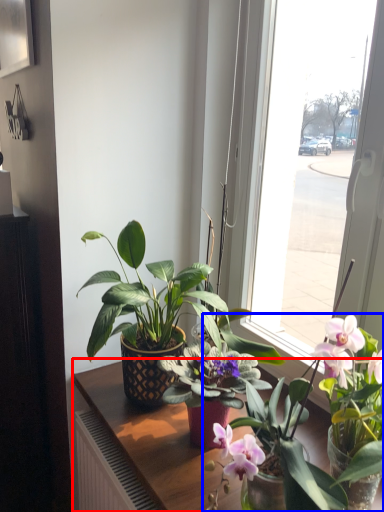
Question: Among these objects, which one is nearest to the camera, table (highlighted by a red box) or houseplant (highlighted by a blue box)?

Choices:
 (A) table
 (B) houseplant

Answer: (B)